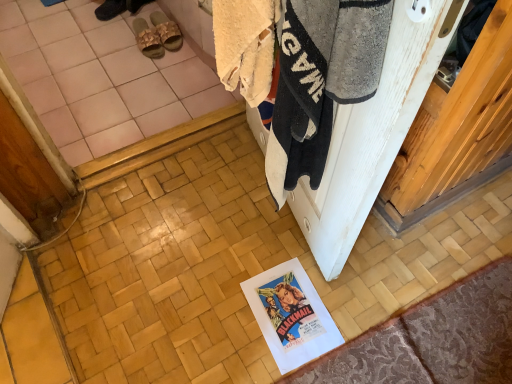
You are a GUI agent. You are given a task and a screenshot of the screen. Output one action in this format:
    pyautogui.click(x=<x>, y=<y>)
    Task: Click on the vacant area to the left of beige woven slipper at upper left, acting as the third footwear starting from the left
    Image resolution: width=512 pixels, height=384 pixels.
    Given the screenshot: What is the action you would take?
    pyautogui.click(x=120, y=39)